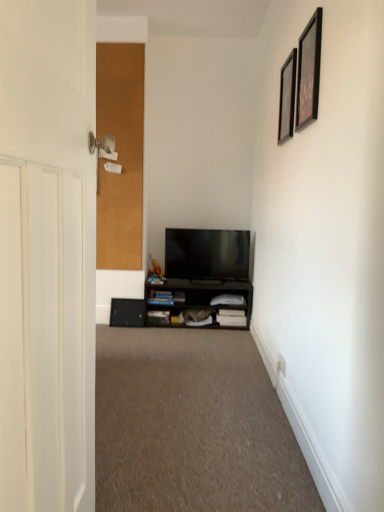
Question: From a real-world perspective, is white wooden door at left, acting as the 2th door starting from the back, positioned above or below black glossy picture frame at upper right, the 2th picture frame when ordered from back to front?

Choices:
 (A) above
 (B) below

Answer: (B)

Question: Relative to black glossy picture frame at upper right, the 2th picture frame when ordered from back to front, is white wooden door at left, marked as the second door in a left-to-right arrangement, in front or behind?

Choices:
 (A) front
 (B) behind

Answer: (A)

Question: Considering the real-world distances, which object is farthest from the black glossy picture frame at upper right, acting as the first picture frame starting from the front?

Choices:
 (A) black matte picture frame at upper right, which is the first picture frame from back to front
 (B) black matte cabinet at lower center
 (C) white wooden door at left, which is the first door from right to left
 (D) flat screen tv at center
 (E) carpet at center

Answer: (B)

Question: Estimate the real-world distances between objects in this image. Which object is closer to the black matte cabinet at lower center?

Choices:
 (A) black matte picture frame at upper right, the 2th picture frame viewed from the front
 (B) carpet at center
 (C) black glossy picture frame at upper right, acting as the first picture frame starting from the front
 (D) flat screen tv at center
 (E) corkboard at left, arranged as the 2th door when viewed from the right

Answer: (D)